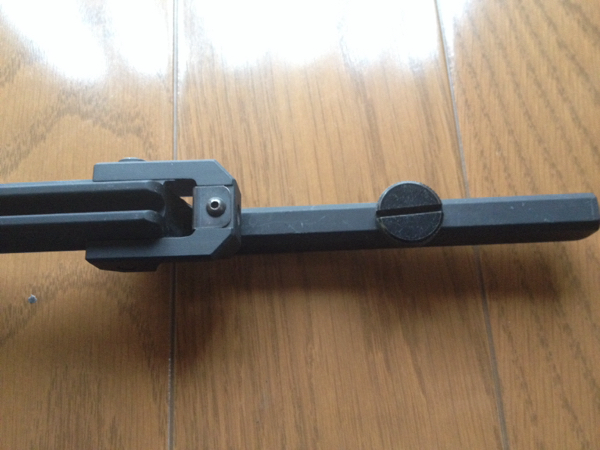
Locate an element on the screen. The height and width of the screenshot is (450, 600). clamp is located at coordinates (128, 230).